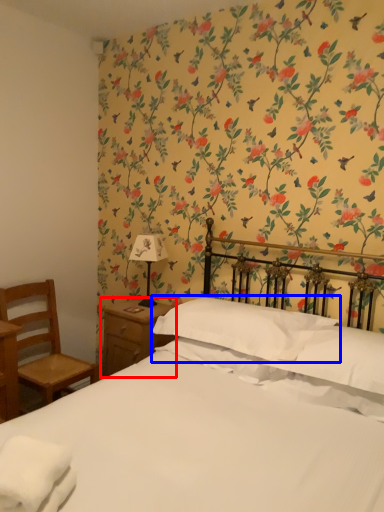
Question: Which point is further to the camera, nightstand (highlighted by a red box) or pillow (highlighted by a blue box)?

Choices:
 (A) nightstand
 (B) pillow

Answer: (A)